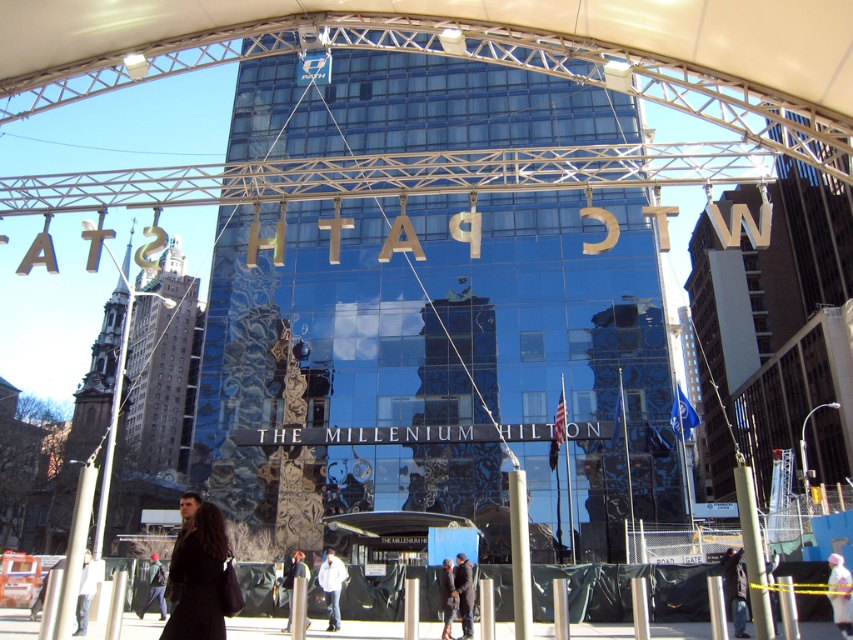
You are standing in front of the Millennium Hilton building and see the light brown leather jacket at lower left. Where exactly is the light brown leather jacket located in relation to the building?

The light brown leather jacket at lower left is located at point (x=85, y=592) in the image.

You are standing in front of the Millennium Hilton building and notice a dark brown leather coat at lower center. Based on its position, can you determine if it is closer to the building or the PATH structure?

The dark brown leather coat at lower center is located at point (x=198, y=577). Since the coordinates place it closer to the lower center, it is likely positioned near the base of the Millennium Hilton building rather than the PATH structure in the foreground.